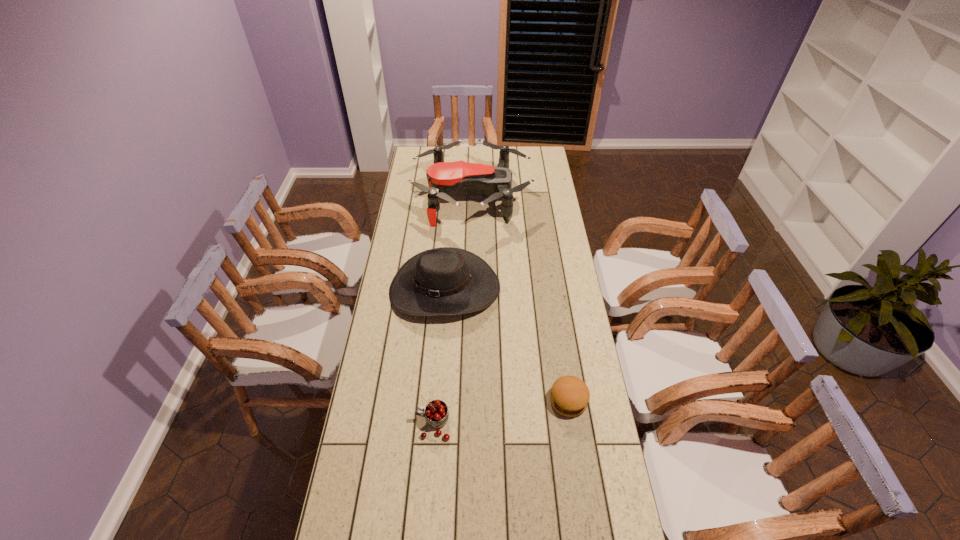
This screenshot has width=960, height=540. In the image, there is a desktop. What are the coordinates of `vacant space at the far left corner` in the screenshot? It's located at (423, 164).

Find the location of a particular element. The height and width of the screenshot is (540, 960). free location at the far right corner is located at coordinates (523, 161).

Locate an element on the screen. blank region between the farthest object and the third nearest object is located at coordinates (458, 243).

Identify the location of vacant area between the second farthest object and the second shortest object. (439, 357).

This screenshot has height=540, width=960. I want to click on empty space that is in between the hamburger and the cowboy hat, so click(x=507, y=345).

Where is `empty space that is in between the third nearest object and the hamburger`? empty space that is in between the third nearest object and the hamburger is located at coordinates (507, 345).

Identify the location of free space between the shortest object and the second farthest object. The height and width of the screenshot is (540, 960). click(x=507, y=345).

I want to click on object that is the third closest to the hamburger, so click(x=445, y=180).

Identify the location of the second closest object to the hamburger. pos(436,415).

Locate an element on the screen. free spot that satisfies the following two spatial constraints: 1. on the camera side of the farthest object; 2. on the front-facing side of the second farthest object is located at coordinates (470, 289).